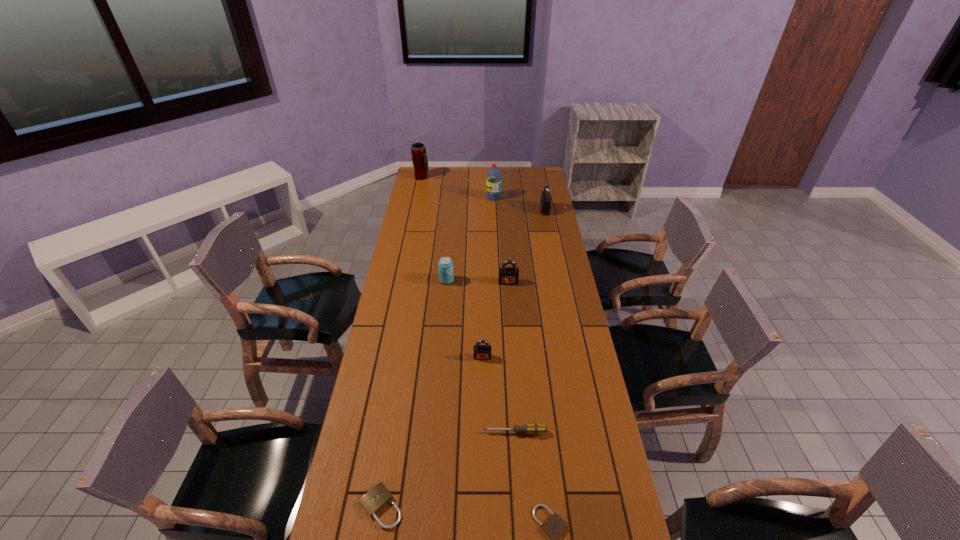
This screenshot has height=540, width=960. In order to click on object at the right edge in this screenshot , I will do (x=545, y=201).

Image resolution: width=960 pixels, height=540 pixels. Identify the location of object located at the far left corner. (419, 158).

Image resolution: width=960 pixels, height=540 pixels. In the image, there is a desktop. In order to click on free region at the far edge in this screenshot , I will do `click(484, 170)`.

In the image, there is a desktop. Where is `vacant area at the left edge`? The image size is (960, 540). vacant area at the left edge is located at coordinates pos(406,433).

This screenshot has width=960, height=540. In order to click on vacant space at the right edge of the desktop in this screenshot , I will do `click(543, 359)`.

In order to click on vacant space at the far right corner of the desktop in this screenshot , I will do `click(527, 186)`.

Locate an element on the screen. free space between the beer can and the smallest gray padlock is located at coordinates (465, 319).

This screenshot has width=960, height=540. What are the coordinates of `free space between the left beige padlock and the red water bottle` in the screenshot? It's located at (437, 352).

This screenshot has width=960, height=540. What are the coordinates of `free space between the red water bottle and the seventh farthest object` in the screenshot? It's located at (504, 315).

Locate an element on the screen. Image resolution: width=960 pixels, height=540 pixels. unoccupied position between the seventh farthest object and the left beige padlock is located at coordinates (448, 469).